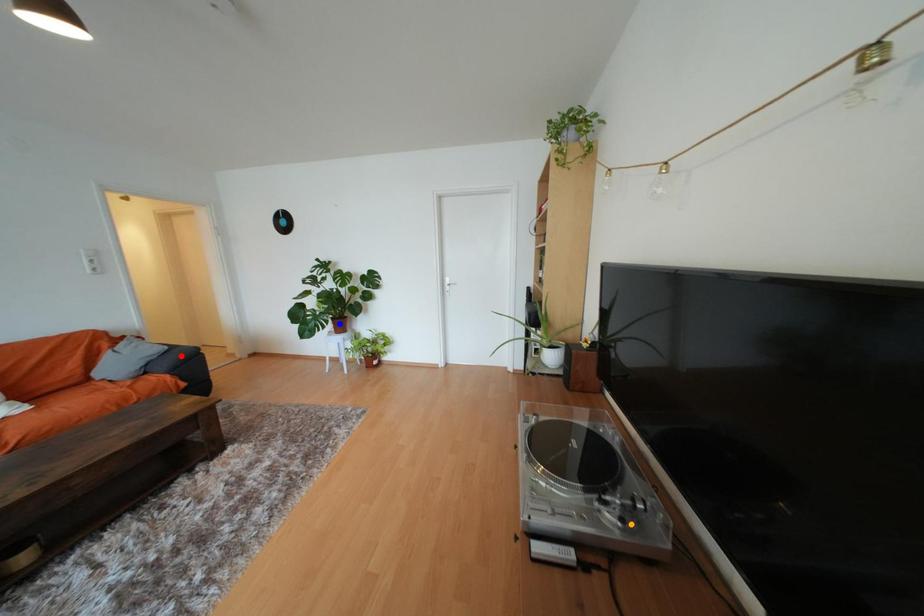
From the picture: Order these from nearest to farthest:
blue point
orange point
red point

1. orange point
2. red point
3. blue point